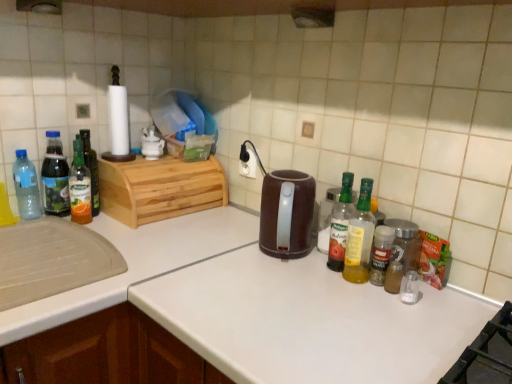
Question: From a real-world perspective, is clear glass spice jar at right, positioned as the first bottle in right-to-left order, above or below brown plastic kettle at center?

Choices:
 (A) above
 (B) below

Answer: (B)

Question: Considering the relative positions of clear glass spice jar at right, positioned as the first bottle in right-to-left order, and brown plastic kettle at center in the image provided, is clear glass spice jar at right, positioned as the first bottle in right-to-left order, to the left or to the right of brown plastic kettle at center?

Choices:
 (A) left
 (B) right

Answer: (B)

Question: Estimate the real-world distances between objects in this image. Which object is farther from the translucent glass bottle at left, arranged as the 6th bottle when viewed from the right?

Choices:
 (A) translucent glass bottle at left, marked as the fourth bottle in a left-to-right arrangement
 (B) translucent plastic spice container at right
 (C) translucent plastic bottle at right, which is the third bottle in right-to-left order
 (D) brown plastic kettle at center
 (E) translucent glass bottle at left, which is counted as the 2th bottle, starting from the left

Answer: (B)

Question: Estimate the real-world distances between objects in this image. Which object is closer to the translucent plastic bottle at right, which is the third bottle in right-to-left order?

Choices:
 (A) clear glass spice jar at right, positioned as the first bottle in right-to-left order
 (B) yellow translucent bottle at right, the fifth bottle in the left-to-right sequence
 (C) translucent glass spice jar at center-right, which is counted as the seventh bottle, starting from the left
 (D) translucent glass bottle at left, arranged as the third bottle when viewed from the left
 (E) brown plastic kettle at center

Answer: (B)